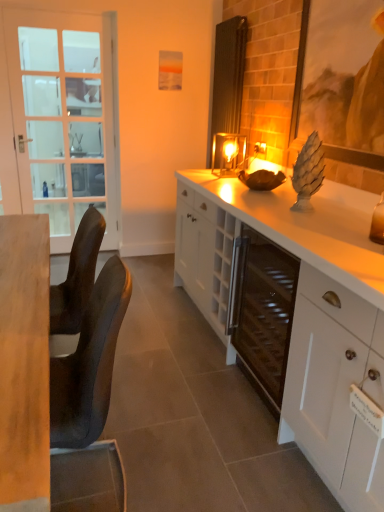
Find the location of a particular element. free space above light brown wood desk at left (from a real-world perspective) is located at coordinates (21, 295).